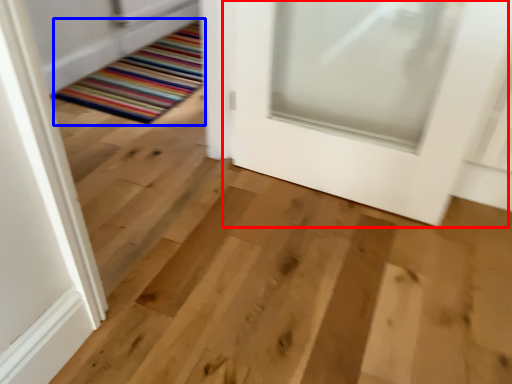
Question: Which point is further to the camera, door (highlighted by a red box) or mat (highlighted by a blue box)?

Choices:
 (A) door
 (B) mat

Answer: (B)